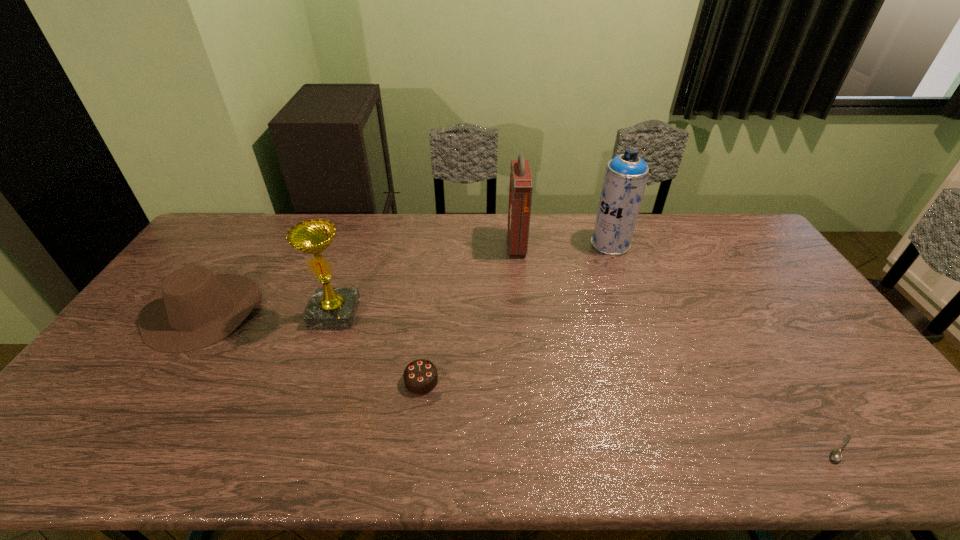
The height and width of the screenshot is (540, 960). I want to click on object that is at the left edge, so click(195, 308).

What are the coordinates of `object that is at the right edge` in the screenshot? It's located at (835, 455).

Find the location of a particular element. This screenshot has height=540, width=960. object that is at the near right corner is located at coordinates (835, 455).

Where is `free location at the far edge`? Image resolution: width=960 pixels, height=540 pixels. free location at the far edge is located at coordinates (337, 223).

Image resolution: width=960 pixels, height=540 pixels. I want to click on vacant space at the near edge of the desktop, so click(374, 464).

You are a GUI agent. You are given a task and a screenshot of the screen. Output one action in this format:
    pyautogui.click(x=<x>, y=<y>)
    Task: Click on the blank space at the right edge of the desktop
    Image resolution: width=960 pixels, height=540 pixels.
    Given the screenshot: What is the action you would take?
    pyautogui.click(x=847, y=370)

In the image, there is a desktop. Identify the location of blank space at the far left corner. (226, 238).

In the image, there is a desktop. Identify the location of vacant space at the near left corner. (65, 438).

At what (x,y) coordinates should I click in order to perform the action: click on free space between the award and the third shortest object. Please return your answer as a coordinate pair (x, y). The image size is (960, 540). Looking at the image, I should click on (269, 312).

Where is `free space between the aerosol can and the rightmost object`? The height and width of the screenshot is (540, 960). free space between the aerosol can and the rightmost object is located at coordinates (726, 346).